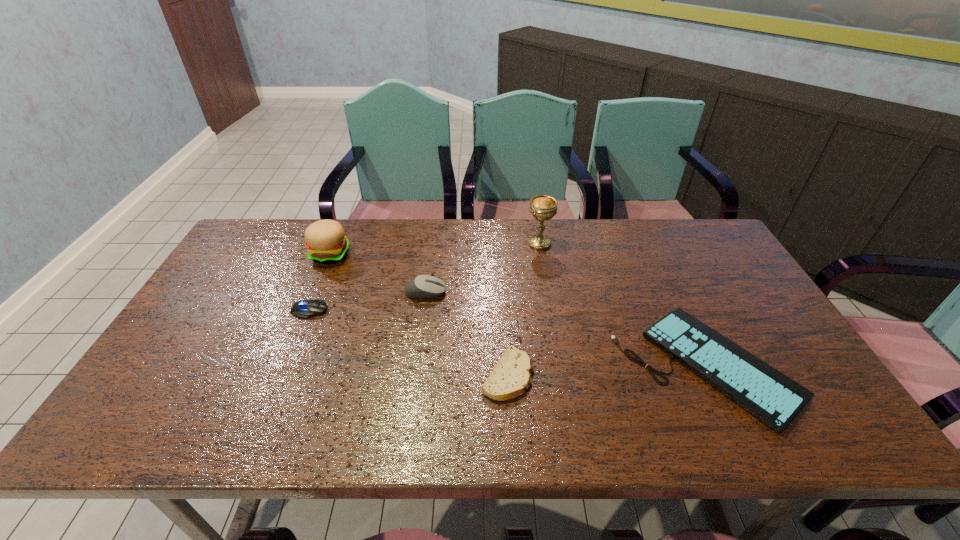
Where is `free space located 0.270m on the right of the hamburger`? The image size is (960, 540). free space located 0.270m on the right of the hamburger is located at coordinates (433, 254).

Locate an element on the screen. vacant space located 0.220m on the wheel side of the third object from left to right is located at coordinates (522, 292).

Locate an element on the screen. free space located 0.380m on the button side of the shorter computer mouse is located at coordinates (464, 310).

The image size is (960, 540). In order to click on vacant space located 0.240m on the back of the rightmost object in this screenshot , I will do `click(654, 255)`.

Locate an element on the screen. The image size is (960, 540). vacant position located 0.220m on the left of the third object from right to left is located at coordinates (391, 375).

This screenshot has height=540, width=960. Identify the location of chalice located at the far edge. (543, 207).

Find the location of a particular element. hamburger that is at the far edge is located at coordinates (326, 243).

At what (x,y) coordinates should I click in order to perform the action: click on object that is positioned at the near edge. Please return your answer as a coordinate pair (x, y). Looking at the image, I should click on (774, 398).

Locate an element on the screen. Image resolution: width=960 pixels, height=540 pixels. object that is at the right edge is located at coordinates (774, 398).

Image resolution: width=960 pixels, height=540 pixels. I want to click on object positioned at the near right corner, so click(x=774, y=398).